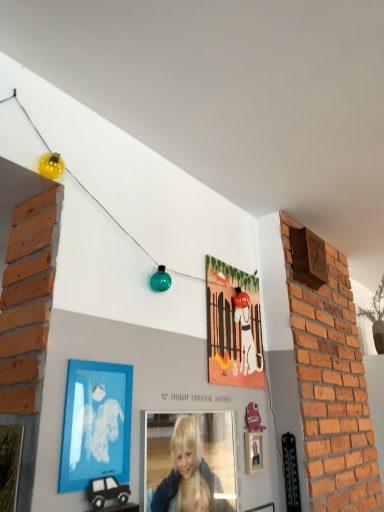
Question: In terms of size, does smooth blonde hair at center appear bigger or smaller than matte paper picture frame at center, which appears as the first picture frame when viewed from the back?

Choices:
 (A) big
 (B) small

Answer: (A)

Question: Would you say smooth blonde hair at center is inside or outside matte paper picture frame at center, which appears as the first picture frame when viewed from the back?

Choices:
 (A) inside
 (B) outside

Answer: (B)

Question: Which is farther from the blue matte picture frame at lower left, which is the 3th picture frame in right-to-left order?

Choices:
 (A) smooth blonde hair at center
 (B) wooden picture frame at lower center, which is the first picture frame from right to left
 (C) wooden picture frame at lower left, placed as the 4th picture frame when sorted from right to left
 (D) matte paper picture frame at center, which appears as the first picture frame when viewed from the back

Answer: (B)

Question: Estimate the real-world distances between objects in this image. Which object is farther from the blue matte picture frame at lower left, which appears as the second picture frame when viewed from the left?

Choices:
 (A) wooden picture frame at lower left, marked as the fourth picture frame in a back-to-front arrangement
 (B) wooden picture frame at lower center, which is the first picture frame from right to left
 (C) smooth blonde hair at center
 (D) matte paper picture frame at center, the second picture frame when ordered from right to left

Answer: (B)